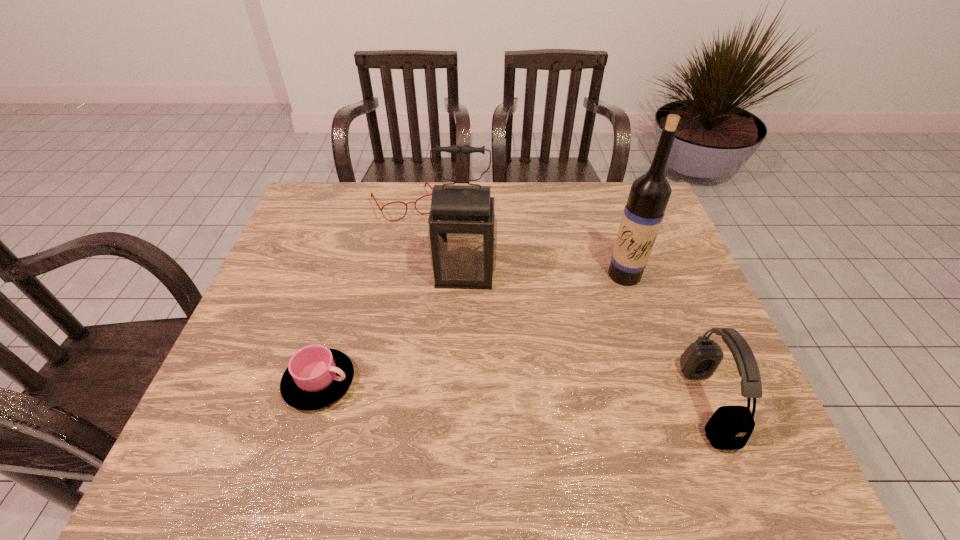
Identify the location of free space located 0.270m on the label of the second object from right to left. click(x=568, y=349).

Locate an element on the screen. The height and width of the screenshot is (540, 960). vacant point located on the label of the second object from right to left is located at coordinates (583, 330).

Locate an element on the screen. This screenshot has height=540, width=960. vacant region located on the label of the second object from right to left is located at coordinates (579, 335).

Where is `free space located 0.310m on the front-facing side of the fourth shortest object`? The height and width of the screenshot is (540, 960). free space located 0.310m on the front-facing side of the fourth shortest object is located at coordinates (453, 396).

This screenshot has width=960, height=540. What are the coordinates of `free location located 0.150m on the front-facing side of the fourth shortest object` in the screenshot? It's located at (x=459, y=338).

The height and width of the screenshot is (540, 960). I want to click on vacant space situated 0.350m on the front-facing side of the fourth shortest object, so click(x=452, y=413).

Where is `vacant space positioned on the face of the spectacles`? The width and height of the screenshot is (960, 540). vacant space positioned on the face of the spectacles is located at coordinates (436, 266).

Identify the location of vacant space located 0.220m on the face of the spectacles. The image size is (960, 540). (437, 268).

The width and height of the screenshot is (960, 540). In order to click on vacant space located 0.180m on the face of the spectacles in this screenshot , I will do `click(433, 259)`.

Find the location of a particular element. The width and height of the screenshot is (960, 540). object that is at the far edge is located at coordinates (381, 209).